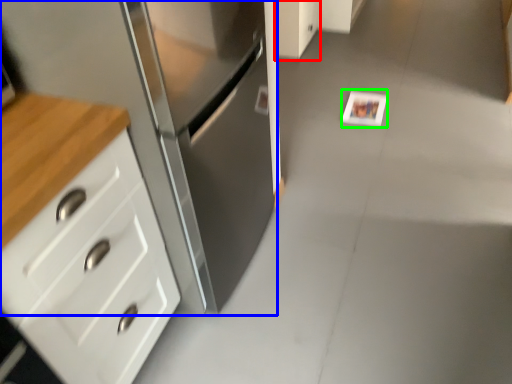
Question: Which is farther away from cabinetry (highlighted by a red box)? cabinetry (highlighted by a blue box) or postcard (highlighted by a green box)?

Choices:
 (A) cabinetry
 (B) postcard

Answer: (A)